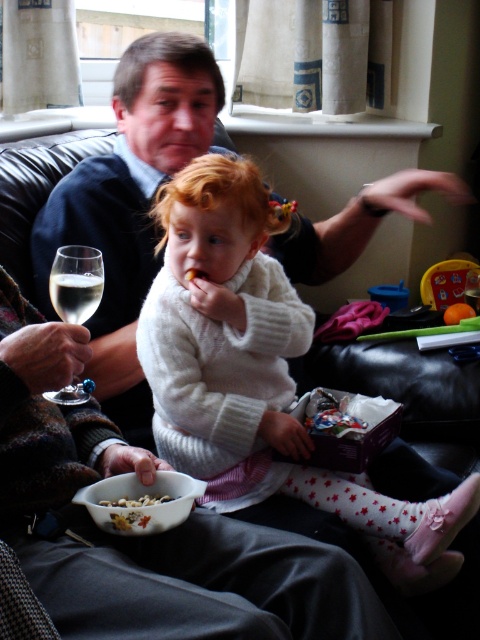
You are a guest in this living room and want to pour yourself a drink from the clear glass wine at upper left. However, you notice a point at coordinates (74, 294). Is this point located on the clear glass wine at upper left or somewhere else?

The point at coordinates (74, 294) is located on the clear glass wine at upper left.

You are a guest in this living room and see the smooth white bowl at lower left and the crumbly brown cereal at lower left. Which object is bigger?

The smooth white bowl at lower left is bigger than the crumbly brown cereal at lower left according to their sizes.

You are a photographer in the living room and want to capture a photo of the white knitted sweater at center and the dark blue sweater at center. Which sweater should you focus on first if you want to ensure both are in the frame without moving the camera?

The white knitted sweater at center is located below the dark blue sweater at center, so you should focus on the dark blue sweater at center first to ensure both are in the frame without moving the camera.